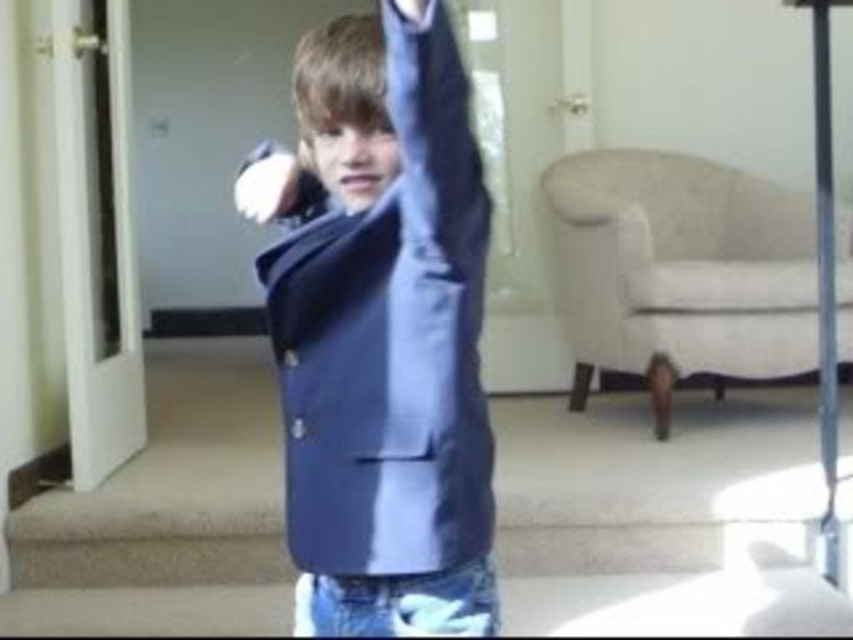
Measure the distance between satin blue blazer at center and camera.

satin blue blazer at center and camera are 37.41 inches apart from each other.

Which of these two, satin blue blazer at center or white matte glove at upper center, stands taller?

With more height is satin blue blazer at center.

Does point (363, 433) lie in front of point (274, 216)?

Yes.

Find the location of a particular element. The height and width of the screenshot is (640, 853). satin blue blazer at center is located at coordinates (386, 339).

Is point (380, 52) less distant than point (270, 140)?

Yes, it is.

What are the coordinates of `satin blue jacket at center` in the screenshot? It's located at (344, 109).

Where is `satin blue jacket at center`? The image size is (853, 640). satin blue jacket at center is located at coordinates (344, 109).

Does point (325, 109) come in front of point (399, 4)?

No, it is not.

How distant is satin blue jacket at center from satin blue blazer at upper center?

satin blue jacket at center and satin blue blazer at upper center are 6.71 inches apart from each other.

Describe the element at coordinates (344, 109) in the screenshot. The width and height of the screenshot is (853, 640). I see `satin blue jacket at center` at that location.

Image resolution: width=853 pixels, height=640 pixels. I want to click on satin blue jacket at center, so click(x=344, y=109).